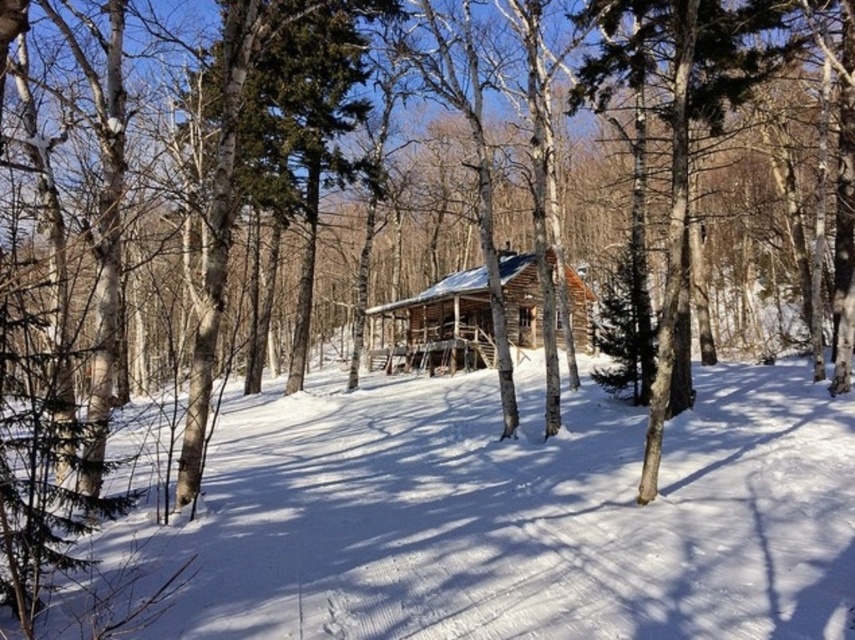
The width and height of the screenshot is (855, 640). I want to click on white powdery snow at center, so click(x=517, y=516).

Can you confirm if white powdery snow at center is shorter than wooden log cabin at center?

Incorrect, white powdery snow at center's height does not fall short of wooden log cabin at center's.

Which is behind, point (252, 467) or point (525, 321)?

Point (525, 321)

This screenshot has height=640, width=855. I want to click on white powdery snow at center, so click(517, 516).